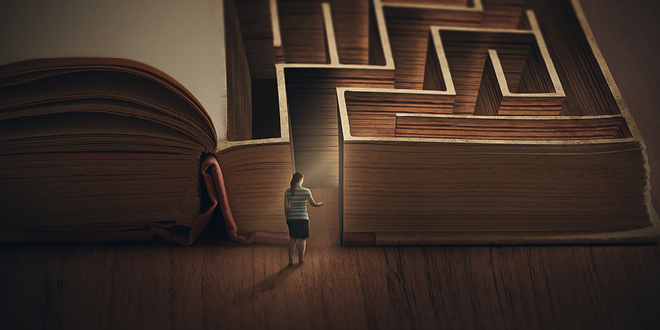
What are the coordinates of `floor` in the screenshot? It's located at (213, 258).